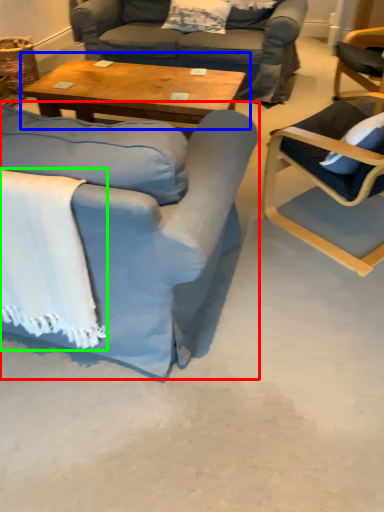
Question: Estimate the real-world distances between objects in this image. Which object is farther from chair (highlighted by a red box), coffee table (highlighted by a blue box) or blanket (highlighted by a green box)?

Choices:
 (A) coffee table
 (B) blanket

Answer: (A)